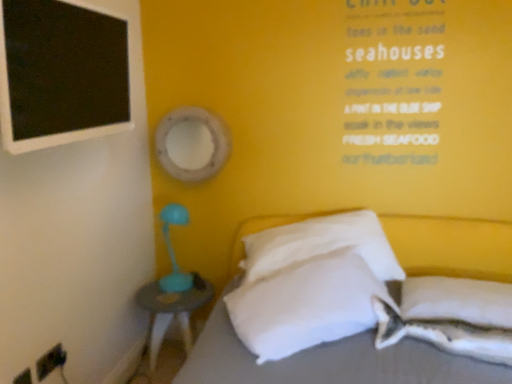
Question: Is black matte board at upper left facing away from white soft pillow at lower right, the 4th pillow from the left?

Choices:
 (A) yes
 (B) no

Answer: (B)

Question: Is black matte board at upper left to the left of white soft pillow at lower right, the 4th pillow from the left, from the viewer's perspective?

Choices:
 (A) yes
 (B) no

Answer: (A)

Question: From the image's perspective, is black matte board at upper left beneath white soft pillow at lower right, the 1th pillow positioned from the right?

Choices:
 (A) yes
 (B) no

Answer: (B)

Question: Does black matte board at upper left come behind white soft pillow at lower right, the 1th pillow positioned from the right?

Choices:
 (A) yes
 (B) no

Answer: (B)

Question: Is black matte board at upper left not inside white soft pillow at lower right, the 1th pillow positioned from the right?

Choices:
 (A) yes
 (B) no

Answer: (A)

Question: Considering the positions of teal plastic nightstand at lower left and white soft pillow at lower right, which is the third pillow from left to right, in the image, is teal plastic nightstand at lower left taller or shorter than white soft pillow at lower right, which is the third pillow from left to right,?

Choices:
 (A) short
 (B) tall

Answer: (B)

Question: From a real-world perspective, is teal plastic nightstand at lower left above or below white soft pillow at lower right, the second pillow from the right?

Choices:
 (A) below
 (B) above

Answer: (A)

Question: Which is correct: teal plastic nightstand at lower left is inside white soft pillow at lower right, the second pillow from the right, or outside of it?

Choices:
 (A) outside
 (B) inside

Answer: (A)

Question: Looking at their shapes, would you say teal plastic nightstand at lower left is wider or thinner than white soft pillow at lower right, the second pillow from the right?

Choices:
 (A) wide
 (B) thin

Answer: (A)

Question: Is point (446, 326) positioned closer to the camera than point (390, 276)?

Choices:
 (A) closer
 (B) farther

Answer: (A)

Question: Choose the correct answer: Is white soft pillow at lower right, the second pillow from the right, inside white soft pillow at center, which appears as the third pillow when viewed from the right, or outside it?

Choices:
 (A) outside
 (B) inside

Answer: (A)

Question: From a real-world perspective, is white soft pillow at lower right, which is the third pillow from left to right, physically located above or below white soft pillow at center, the 2th pillow in the left-to-right sequence?

Choices:
 (A) above
 (B) below

Answer: (B)

Question: From the image's perspective, relative to white soft pillow at center, the 2th pillow in the left-to-right sequence, is white soft pillow at lower right, the second pillow from the right, above or below?

Choices:
 (A) below
 (B) above

Answer: (A)

Question: Is black matte board at upper left spatially inside teal plastic nightstand at lower left, or outside of it?

Choices:
 (A) inside
 (B) outside

Answer: (B)

Question: Relative to teal plastic nightstand at lower left, is black matte board at upper left in front or behind?

Choices:
 (A) front
 (B) behind

Answer: (A)